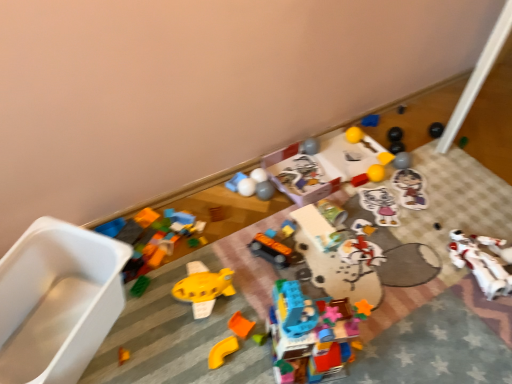
Locate an element on the screen. The image size is (512, 384). vacant space that is in between white plastic robot at lower right, which appears as the seventeenth toy when viewed from the left, and white plastic container at left, which is counted as the first toy, starting from the left is located at coordinates (307, 291).